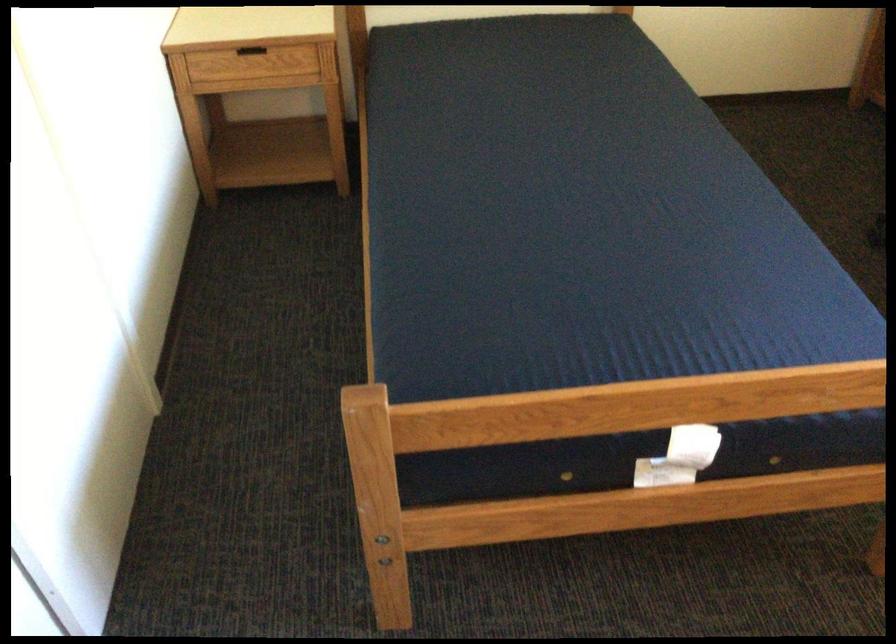
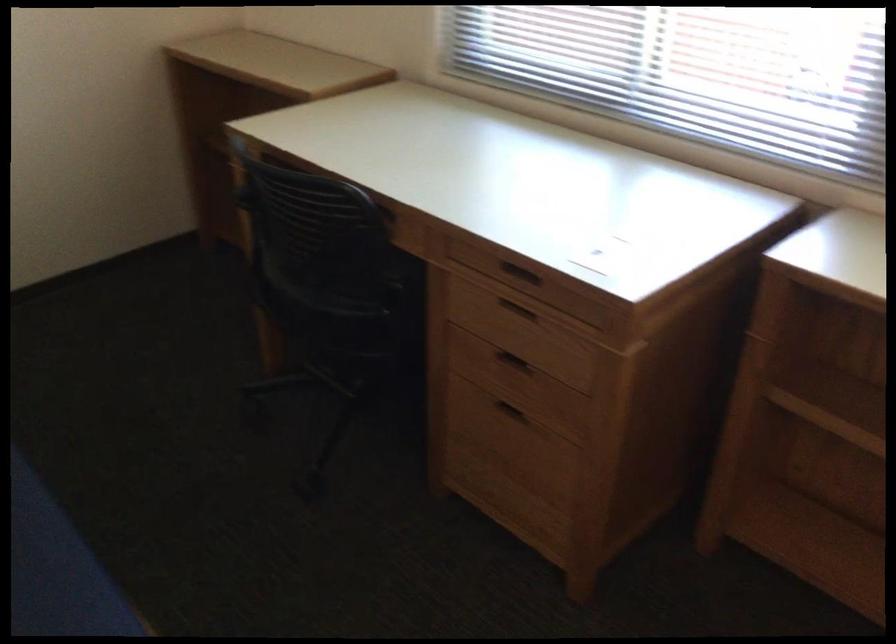
Question: The camera is either moving clockwise (left) or counter-clockwise (right) around the object. The first image is from the beginning of the video and the second image is from the end. Is the camera moving left or right when shooting the video?

Choices:
 (A) Left
 (B) Right

Answer: (A)